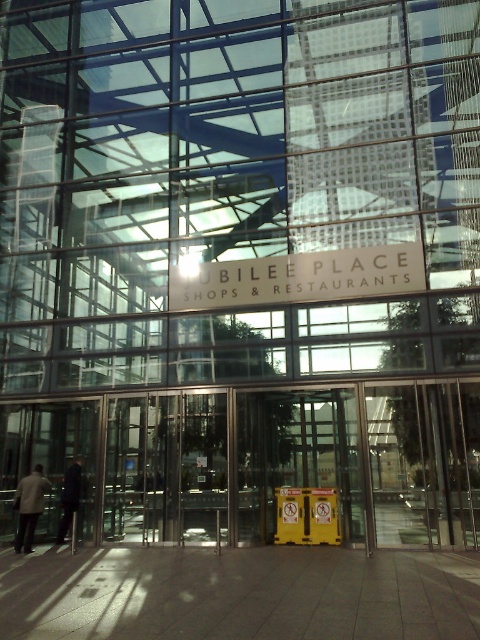
Can you confirm if white matte sign at center is wider than light beige jacket at lower left?

Indeed, white matte sign at center has a greater width compared to light beige jacket at lower left.

Does point (409, 288) come in front of point (34, 486)?

Yes, point (409, 288) is closer to viewer.

Between point (278, 273) and point (33, 509), which one is positioned behind?

The point (278, 273) is behind.

Identify the location of white matte sign at center. This screenshot has height=640, width=480. (298, 276).

Is white matte sign at center closer to camera compared to dark blue suit at center?

That is True.

Can you confirm if white matte sign at center is shorter than dark blue suit at center?

Correct, white matte sign at center is not as tall as dark blue suit at center.

Where is `white matte sign at center`? The image size is (480, 640). white matte sign at center is located at coordinates (298, 276).

The width and height of the screenshot is (480, 640). Find the location of `white matte sign at center`. white matte sign at center is located at coordinates (298, 276).

Is light beige jacket at lower left further to the viewer compared to dark blue suit at center?

No.

Looking at this image, can you confirm if light beige jacket at lower left is positioned above dark blue suit at center?

Yes, light beige jacket at lower left is above dark blue suit at center.

Find the location of a particular element. light beige jacket at lower left is located at coordinates tap(28, 506).